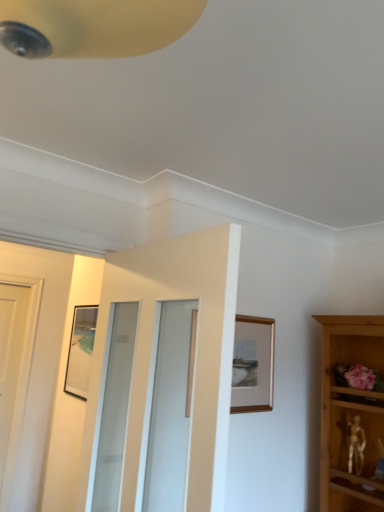
Question: In terms of height, does wooden picture frame at upper center look taller or shorter compared to white glossy door at center?

Choices:
 (A) tall
 (B) short

Answer: (B)

Question: Visually, is wooden picture frame at upper center positioned to the left or to the right of white glossy door at center?

Choices:
 (A) left
 (B) right

Answer: (B)

Question: Considering the positions of point (269, 329) and point (190, 281), is point (269, 329) closer or farther from the camera than point (190, 281)?

Choices:
 (A) closer
 (B) farther

Answer: (B)

Question: Considering their positions, is white glossy door at center located in front of or behind wooden picture frame at upper center?

Choices:
 (A) front
 (B) behind

Answer: (A)

Question: Is white glossy door at center situated inside wooden picture frame at upper center or outside?

Choices:
 (A) inside
 (B) outside

Answer: (B)

Question: Considering the positions of white glossy door at center and wooden picture frame at upper center in the image, is white glossy door at center wider or thinner than wooden picture frame at upper center?

Choices:
 (A) thin
 (B) wide

Answer: (B)

Question: From the image's perspective, is white glossy door at center positioned above or below wooden picture frame at upper center?

Choices:
 (A) below
 (B) above

Answer: (B)